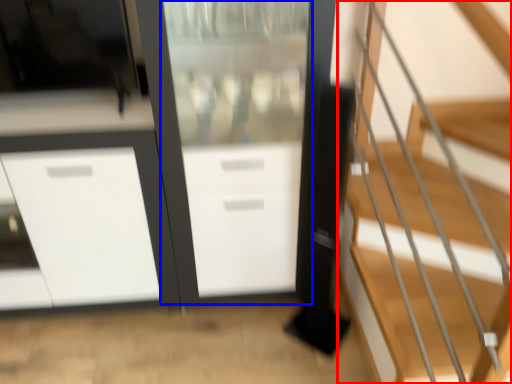
Question: Which of the following is the farthest to the observer, stairs (highlighted by a red box) or screen door (highlighted by a blue box)?

Choices:
 (A) stairs
 (B) screen door

Answer: (B)